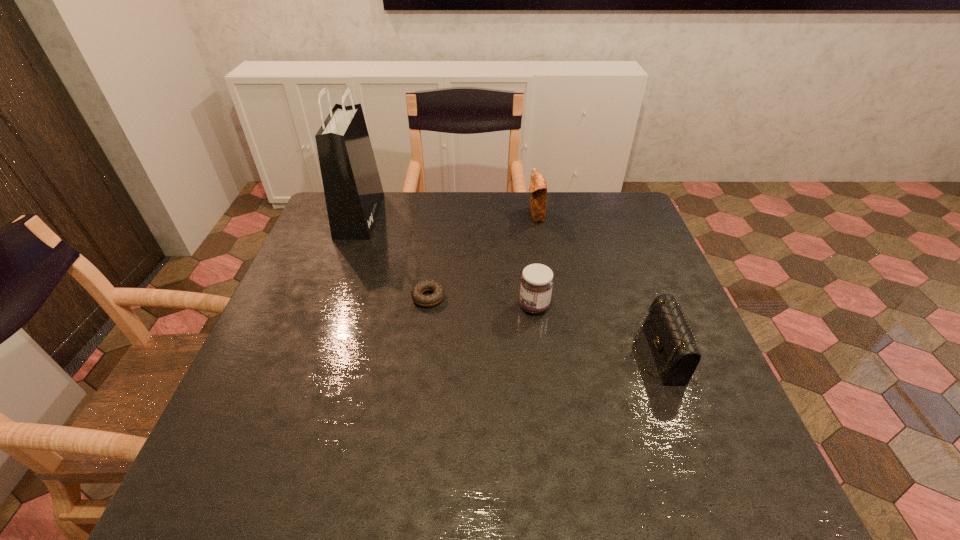
Locate an element on the screen. the tallest object is located at coordinates (353, 191).

Find the location of a particular element. The image size is (960, 540). the leftmost object is located at coordinates (353, 191).

Image resolution: width=960 pixels, height=540 pixels. What are the coordinates of `the farther clutch bag` in the screenshot? It's located at (538, 188).

Locate an element on the screen. the fourth shortest object is located at coordinates (538, 188).

Find the location of a particular element. Image resolution: width=960 pixels, height=540 pixels. jam is located at coordinates (537, 281).

The image size is (960, 540). Identify the location of the rightmost object. (672, 342).

Find the location of a particular element. The width and height of the screenshot is (960, 540). the nearest object is located at coordinates (672, 342).

Locate an element on the screen. This screenshot has height=540, width=960. the fourth object from right to left is located at coordinates (436, 297).

Identify the location of doughnut. The width and height of the screenshot is (960, 540). (436, 297).

You are a GUI agent. You are given a task and a screenshot of the screen. Output one action in this format:
    pyautogui.click(x=<x>, y=<y>)
    Task: Click on the free space located on the front with handles of the leftmost object
    
    Given the screenshot: What is the action you would take?
    point(399,215)